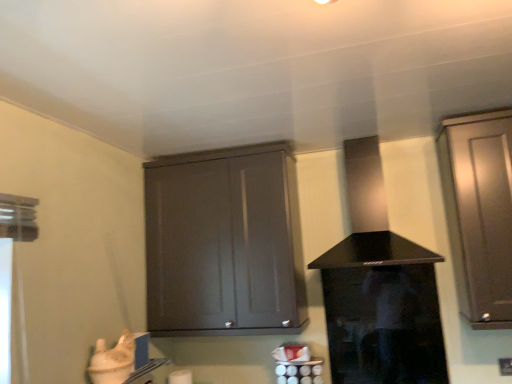
Where is `free space above black glass vent at center (from a real-world perspective)`? free space above black glass vent at center (from a real-world perspective) is located at coordinates (361, 130).